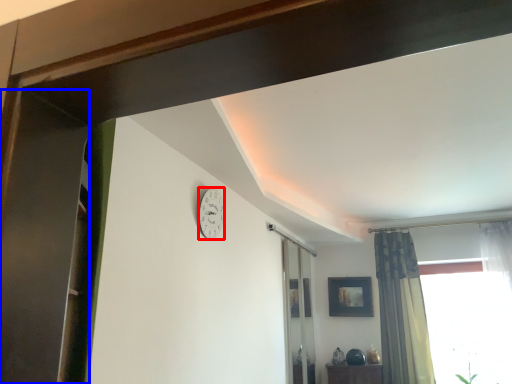
Question: Which of the following is the closest to the observer, clock (highlighted by a red box) or screen door (highlighted by a blue box)?

Choices:
 (A) clock
 (B) screen door

Answer: (B)